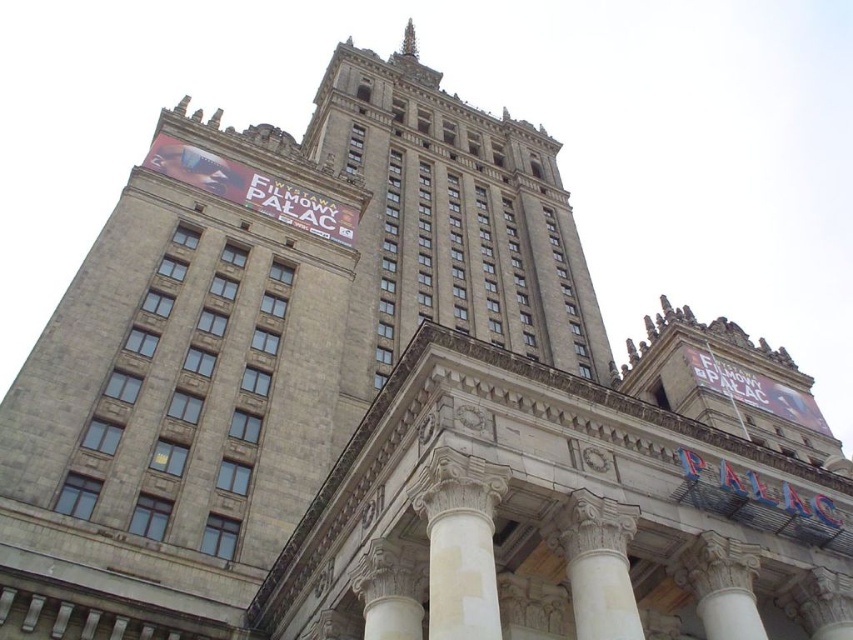
Does white marble column at center appear on the right side of white marble pillar at center?

In fact, white marble column at center is to the left of white marble pillar at center.

Does point (612, 513) lie behind point (751, 612)?

Yes, it is behind point (751, 612).

Find the location of `white marble column at center`. white marble column at center is located at coordinates (596, 564).